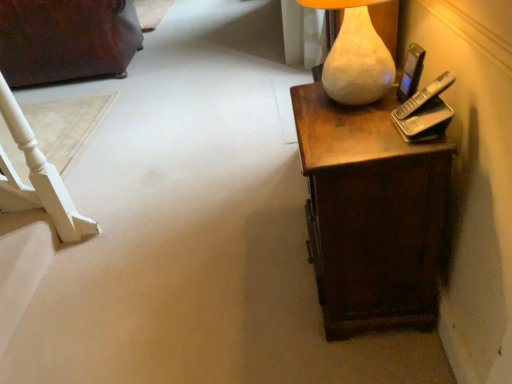
Question: Considering the positions of point (368, 173) and point (365, 34), is point (368, 173) closer or farther from the camera than point (365, 34)?

Choices:
 (A) closer
 (B) farther

Answer: (A)

Question: Is brown wood desk at right inside or outside of matte white lamp at upper right?

Choices:
 (A) outside
 (B) inside

Answer: (A)

Question: Which object is positioned closest to the dark brown wood dresser at upper left?

Choices:
 (A) brown wood desk at right
 (B) black plastic mobile phone at upper right
 (C) matte white lamp at upper right

Answer: (C)

Question: Which of these objects is positioned closest to the black plastic mobile phone at upper right?

Choices:
 (A) dark brown wood dresser at upper left
 (B) brown wood desk at right
 (C) matte white lamp at upper right

Answer: (C)